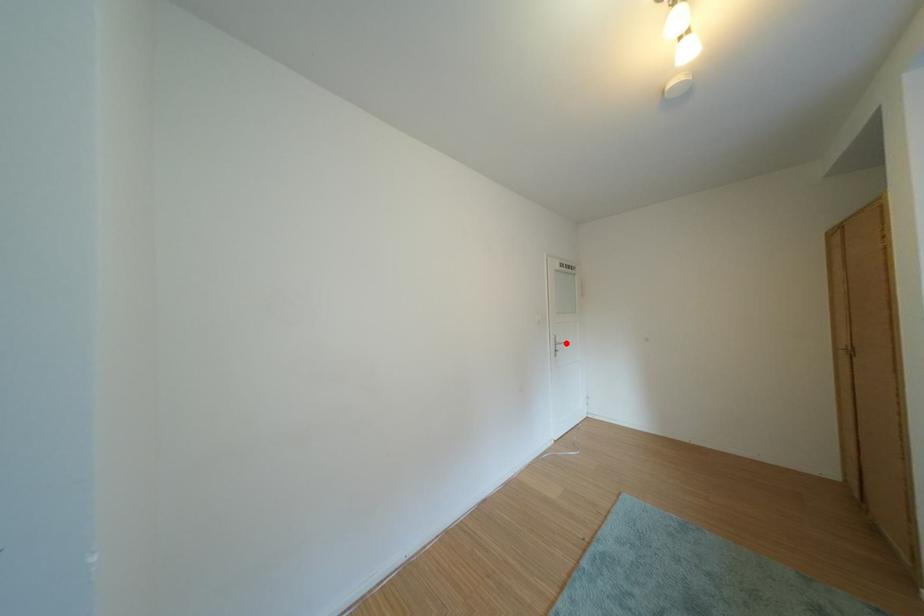
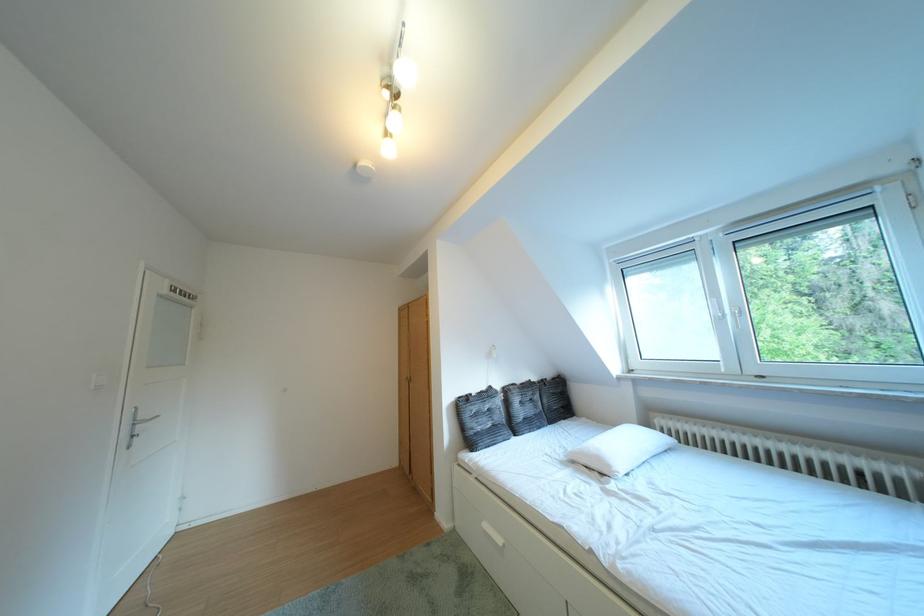
Where in the second image is the point corresponding to the highlighted location from the first image?

(141, 418)